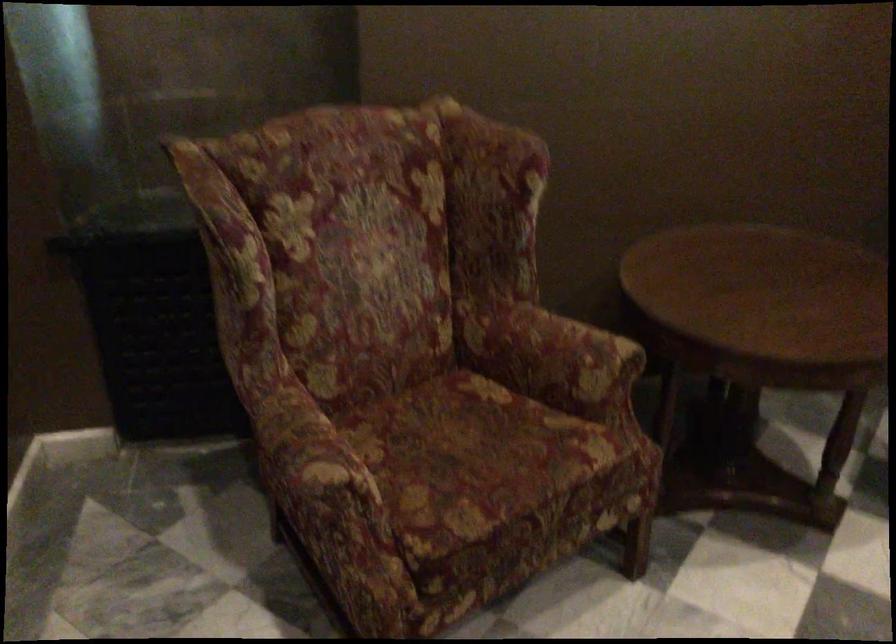
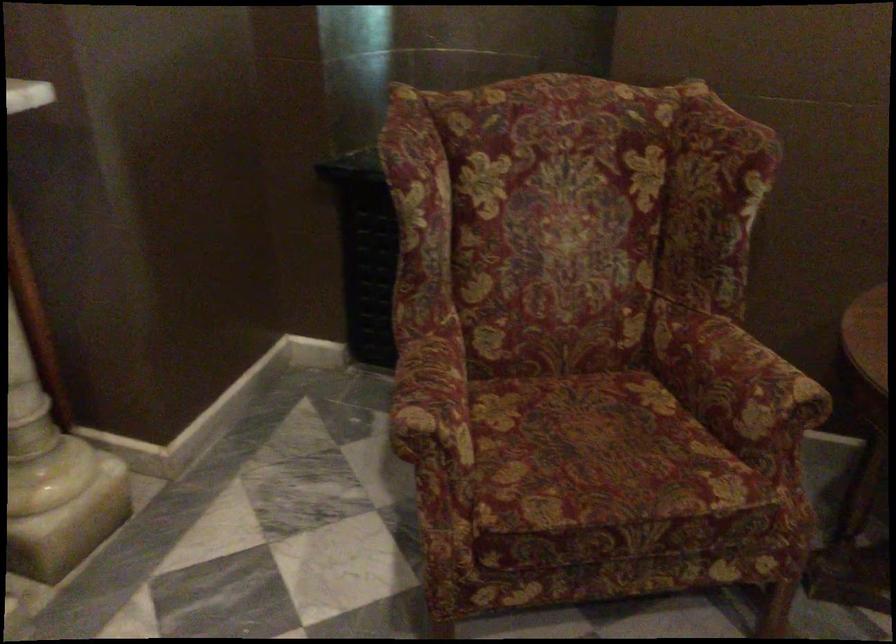
Question: The camera is either moving clockwise (left) or counter-clockwise (right) around the object. The first image is from the beginning of the video and the second image is from the end. Is the camera moving left or right when shooting the video?

Choices:
 (A) Left
 (B) Right

Answer: (B)